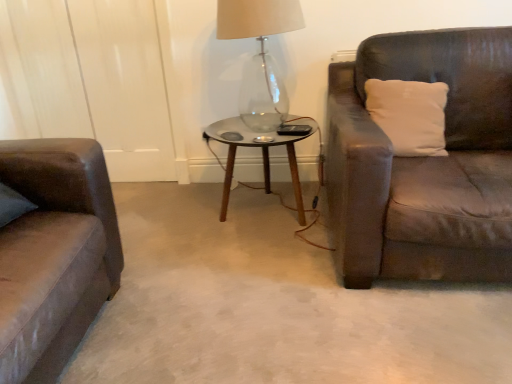
The width and height of the screenshot is (512, 384). Describe the element at coordinates (409, 115) in the screenshot. I see `white soft pillow at right` at that location.

What is the approximate height of transparent glass coffee table at center?

It is 18.15 inches.

Locate an element on the screen. This screenshot has height=384, width=512. transparent glass table lamp at center is located at coordinates (260, 56).

Locate an element on the screen. Image resolution: width=512 pixels, height=384 pixels. white soft pillow at right is located at coordinates (409, 115).

From a real-world perspective, is white soft pillow at right on transparent glass table lamp at center?

Incorrect, from a real-world perspective, white soft pillow at right is lower than transparent glass table lamp at center.

Could transparent glass table lamp at center be considered to be inside white soft pillow at right?

No, transparent glass table lamp at center is not inside white soft pillow at right.

Based on their sizes in the image, would you say white soft pillow at right is bigger or smaller than transparent glass table lamp at center?

Considering their sizes, white soft pillow at right takes up less space than transparent glass table lamp at center.

From the image's perspective, relative to transparent glass table lamp at center, is white soft pillow at right above or below?

white soft pillow at right is situated lower than transparent glass table lamp at center in the image.

From a real-world perspective, is transparent glass table lamp at center above or below white soft pillow at right?

From a real-world perspective, transparent glass table lamp at center is physically above white soft pillow at right.

Considering the sizes of transparent glass table lamp at center and white soft pillow at right in the image, is transparent glass table lamp at center wider or thinner than white soft pillow at right?

Clearly, transparent glass table lamp at center has more width compared to white soft pillow at right.

Which object is further away from the camera taking this photo, transparent glass table lamp at center or white soft pillow at right?

transparent glass table lamp at center is more distant.

How different are the orientations of transparent glass table lamp at center and white soft pillow at right in degrees?

The angular difference between transparent glass table lamp at center and white soft pillow at right is 3.39 degrees.

From the image's perspective, is transparent glass coffee table at center beneath transparent glass table lamp at center?

Yes.

Is transparent glass coffee table at center taller or shorter than transparent glass table lamp at center?

In the image, transparent glass coffee table at center appears to be shorter than transparent glass table lamp at center.

Is transparent glass coffee table at center touching transparent glass table lamp at center?

No, transparent glass coffee table at center is not beside transparent glass table lamp at center.

At what (x,y) coordinates should I click in order to perform the action: click on coffee table below the transparent glass table lamp at center (from the image's perspective). Please return your answer as a coordinate pair (x, y). Image resolution: width=512 pixels, height=384 pixels. Looking at the image, I should click on [262, 155].

From a real-world perspective, is white soft pillow at right over transparent glass coffee table at center?

Yes.

Who is taller, white soft pillow at right or transparent glass coffee table at center?

transparent glass coffee table at center.

Considering the relative positions of white soft pillow at right and transparent glass coffee table at center in the image provided, is white soft pillow at right to the left of transparent glass coffee table at center from the viewer's perspective?

Incorrect, white soft pillow at right is not on the left side of transparent glass coffee table at center.

Considering the sizes of white soft pillow at right and transparent glass coffee table at center in the image, is white soft pillow at right wider or thinner than transparent glass coffee table at center?

white soft pillow at right is thinner than transparent glass coffee table at center.

From the image's perspective, is transparent glass table lamp at center positioned above or below transparent glass coffee table at center?

Clearly, from the image's perspective, transparent glass table lamp at center is above transparent glass coffee table at center.

Considering the sizes of objects transparent glass table lamp at center and transparent glass coffee table at center in the image provided, who is thinner, transparent glass table lamp at center or transparent glass coffee table at center?

transparent glass table lamp at center.

How many degrees apart are the facing directions of transparent glass table lamp at center and transparent glass coffee table at center?

They differ by 0.000361 degrees in their facing directions.

Which object is more forward, transparent glass table lamp at center or transparent glass coffee table at center?

transparent glass table lamp at center is in front.

How far apart are transparent glass coffee table at center and white soft pillow at right?

They are 47.69 centimeters apart.

Is white soft pillow at right at the back of transparent glass coffee table at center?

No, transparent glass coffee table at center is not facing the opposite direction of white soft pillow at right.

Which object is thinner, transparent glass coffee table at center or white soft pillow at right?

white soft pillow at right is thinner.

Is the position of transparent glass coffee table at center more distant than that of white soft pillow at right?

Yes, the depth of transparent glass coffee table at center is greater than that of white soft pillow at right.

Locate an element on the screen. pillow in front of the transparent glass table lamp at center is located at coordinates (409, 115).

This screenshot has height=384, width=512. Identify the location of table lamp positioned vertically above the white soft pillow at right (from a real-world perspective). (260, 56).

Which object lies further to the anchor point transparent glass table lamp at center, white soft pillow at right or transparent glass coffee table at center?

Among the two, white soft pillow at right is located further to transparent glass table lamp at center.

Considering their positions, is transparent glass table lamp at center positioned closer to transparent glass coffee table at center than white soft pillow at right?

transparent glass table lamp at center.

Based on the photo, looking at the image, which one is located further to transparent glass coffee table at center, white soft pillow at right or transparent glass table lamp at center?

white soft pillow at right lies further to transparent glass coffee table at center than the other object.

Estimate the real-world distances between objects in this image. Which object is further from white soft pillow at right, transparent glass table lamp at center or transparent glass coffee table at center?

transparent glass table lamp at center is positioned further to the anchor white soft pillow at right.

Based on their spatial positions, is transparent glass coffee table at center or transparent glass table lamp at center further from white soft pillow at right?

Based on the image, transparent glass table lamp at center appears to be further to white soft pillow at right.

Estimate the real-world distances between objects in this image. Which object is further from transparent glass table lamp at center, transparent glass coffee table at center or white soft pillow at right?

white soft pillow at right is further to transparent glass table lamp at center.

You are a GUI agent. You are given a task and a screenshot of the screen. Output one action in this format:
    pyautogui.click(x=<x>, y=<y>)
    Task: Click on the coffee table between transparent glass table lamp at center and white soft pillow at right
    The width and height of the screenshot is (512, 384).
    Given the screenshot: What is the action you would take?
    coord(262,155)